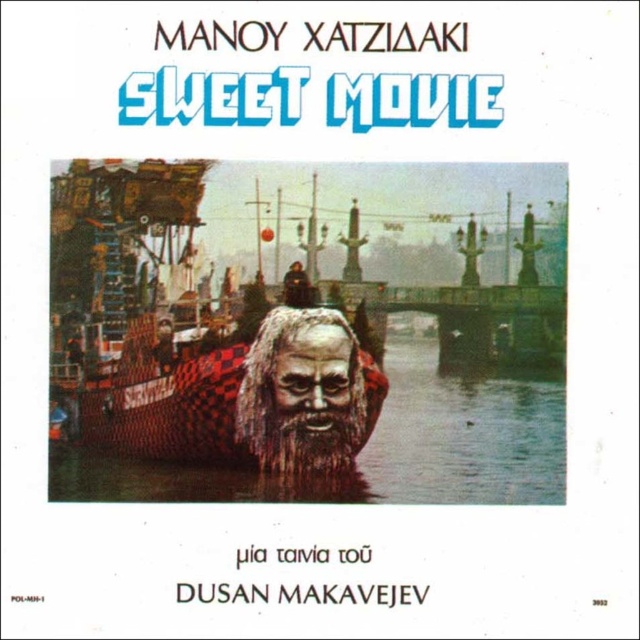
Question: Does metallic water at center have a smaller size compared to brown textured face at center?

Choices:
 (A) no
 (B) yes

Answer: (A)

Question: Among these points, which one is farthest from the camera?

Choices:
 (A) (342, 332)
 (B) (456, 480)

Answer: (B)

Question: Which of the following is the farthest from the observer?

Choices:
 (A) metallic water at center
 (B) grayish textured mask at center
 (C) brown textured face at center

Answer: (A)

Question: Estimate the real-world distances between objects in this image. Which object is closer to the metallic water at center?

Choices:
 (A) grayish textured mask at center
 (B) brown textured face at center

Answer: (A)

Question: Does metallic water at center appear on the left side of grayish textured mask at center?

Choices:
 (A) no
 (B) yes

Answer: (B)

Question: Can you confirm if metallic water at center is positioned below brown textured face at center?

Choices:
 (A) no
 (B) yes

Answer: (B)